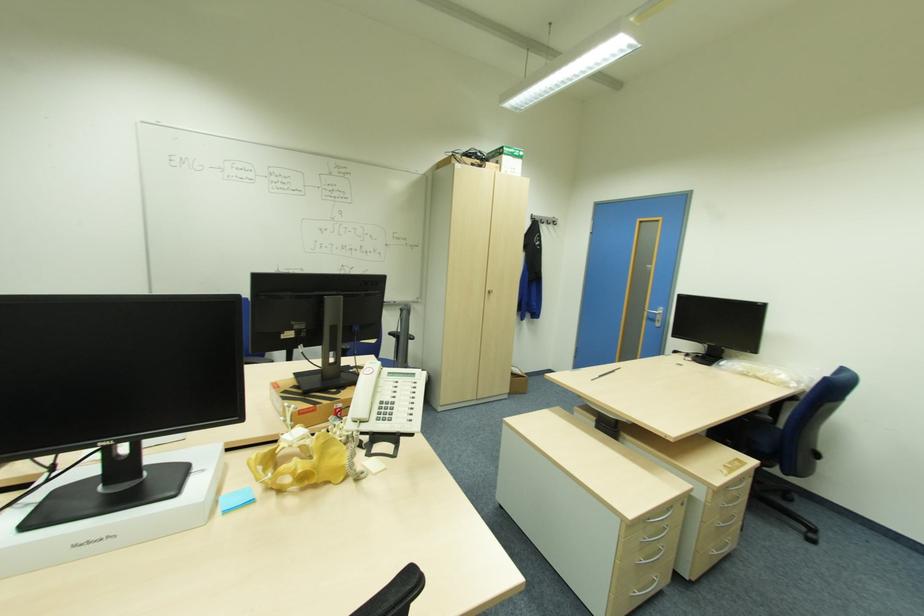
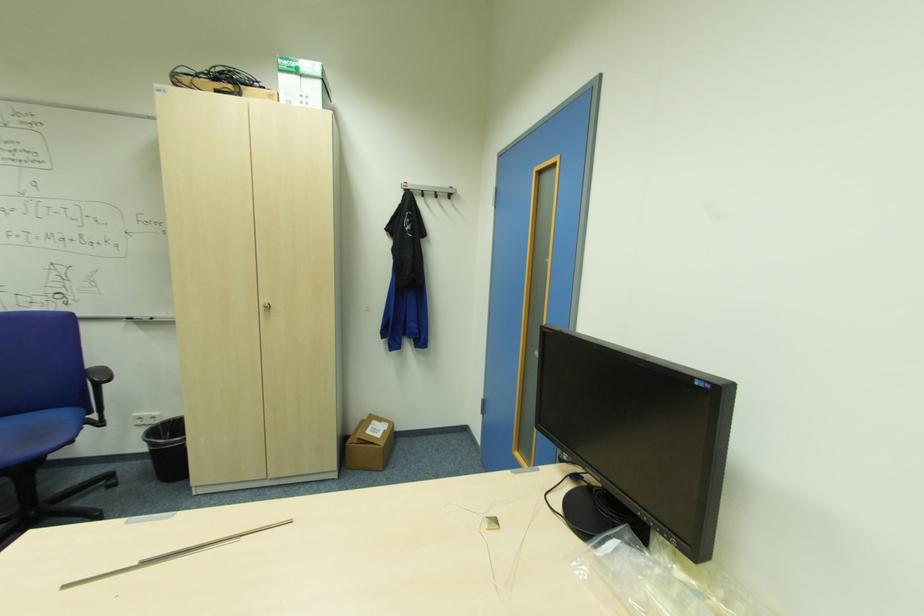
Where in the second image is the point corresponding to [594,379] from the first image?

(63, 589)